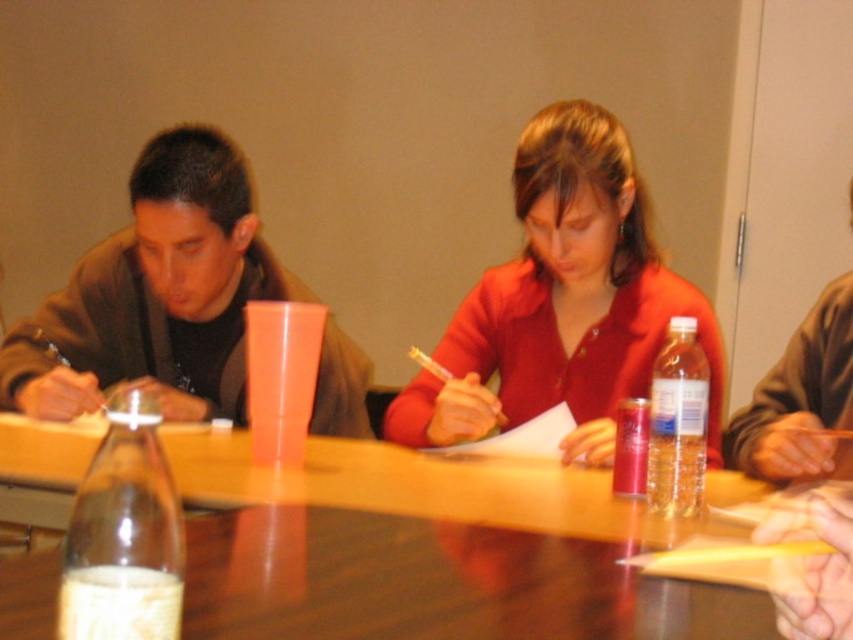
Where is the matte red shirt at center located in the image?

The matte red shirt at center is located at point 0.473 on the x axis and 0.661 on the y axis.

You are a tailor measuring for a new jacket. You see the matte brown jacket at left and the clear plastic bottle at lower left. Which object is wider?

The matte brown jacket at left is wider than the clear plastic bottle at lower left.

You are a delivery person who needs to place a small package between the matte brown jacket at left and the clear plastic bottle at lower left. Can you fit it there?

The distance between the matte brown jacket at left and the clear plastic bottle at lower left is 3.62 feet, so yes, the small package can fit there as the space is sufficient.